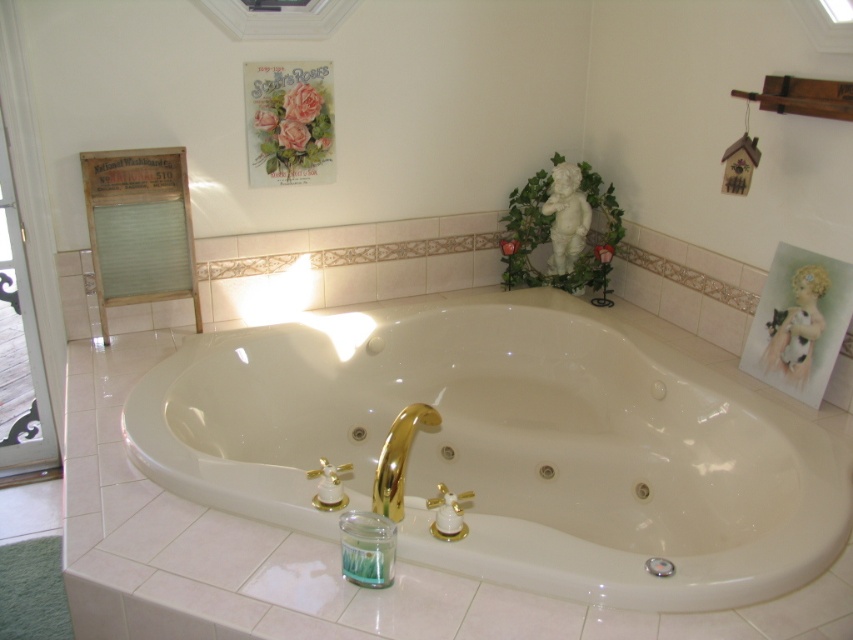
Is white glossy bathtub at center thinner than clear glass screen door at left?

Incorrect, white glossy bathtub at center's width is not less than clear glass screen door at left's.

Who is taller, white glossy bathtub at center or clear glass screen door at left?

Standing taller between the two is clear glass screen door at left.

Is point (431, 348) positioned after point (9, 266)?

Yes, point (431, 348) is behind point (9, 266).

The image size is (853, 640). I want to click on white glossy bathtub at center, so click(509, 445).